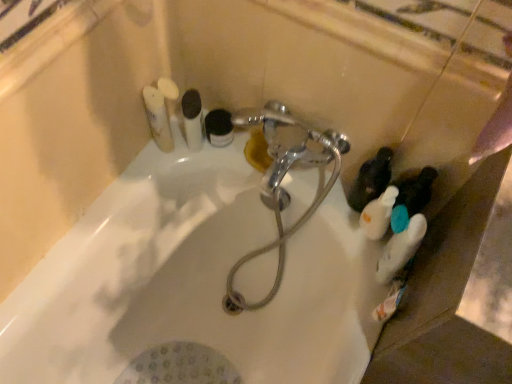
Locate an element on the screen. free space to the left of white matte bottle at lower right is located at coordinates (336, 244).